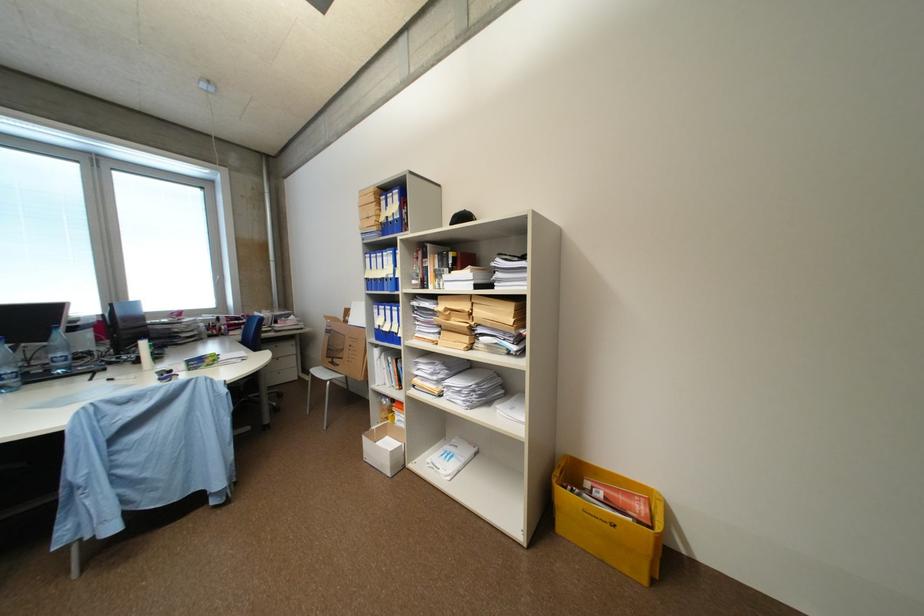
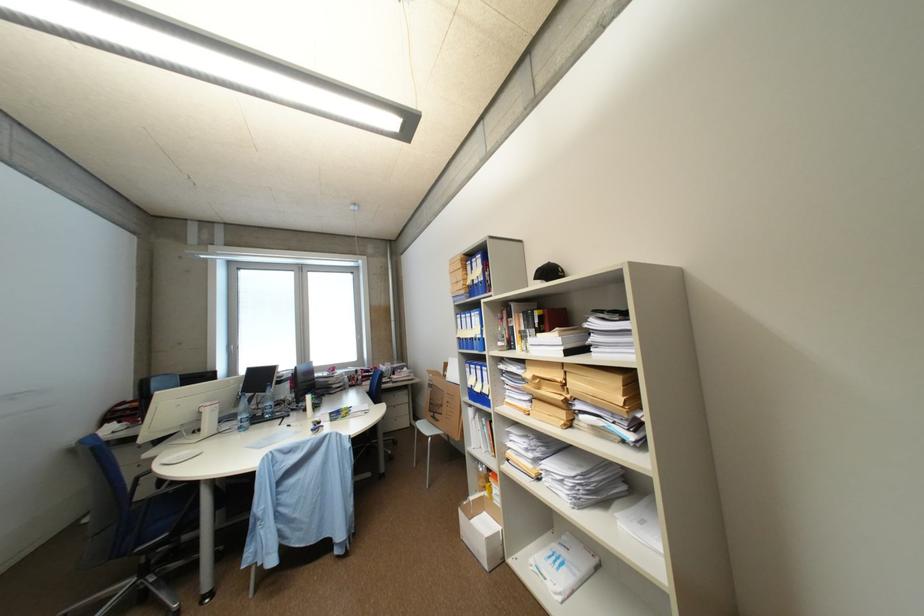
In a continuous first-person perspective shot, in which direction is the camera moving?

The cameraman moved toward right, forward.